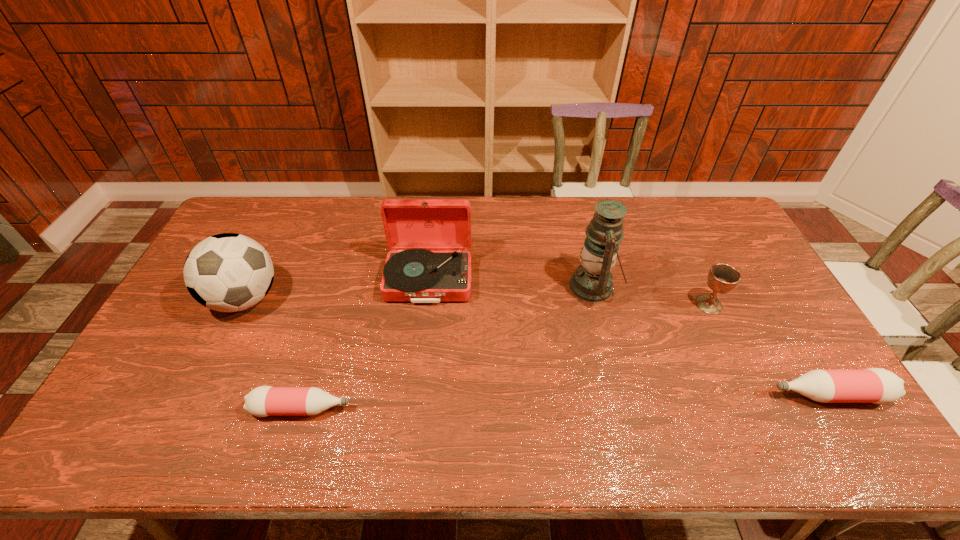
Where is `vacant space located 0.090m with the cap open on the shorter bottle`? vacant space located 0.090m with the cap open on the shorter bottle is located at coordinates (388, 409).

Locate an element on the screen. Image resolution: width=960 pixels, height=540 pixels. vacant area situated 0.280m with the cap open on the rightmost object is located at coordinates (660, 395).

Find the location of `free location located 0.160m with the cap open on the rightmost object`. free location located 0.160m with the cap open on the rightmost object is located at coordinates (708, 395).

Where is `vacant point located with the cap open on the rightmost object`? vacant point located with the cap open on the rightmost object is located at coordinates (653, 395).

Where is `free spot located 0.280m on the back of the chalice`? The width and height of the screenshot is (960, 540). free spot located 0.280m on the back of the chalice is located at coordinates (676, 235).

Locate an element on the screen. The image size is (960, 540). vacant area situated 0.090m on the back of the tallest object is located at coordinates (584, 245).

Find the location of a particular element. vacant region located on the front-facing side of the phonograph_record is located at coordinates pyautogui.click(x=416, y=400).

Identify the location of vacant space situated on the main logo of the soccer ball. pyautogui.click(x=218, y=354).

You are a GUI agent. You are given a task and a screenshot of the screen. Output one action in this format:
    pyautogui.click(x=<x>, y=<y>)
    Task: Click on the object that is at the left edge
    
    Given the screenshot: What is the action you would take?
    pyautogui.click(x=228, y=272)

Image resolution: width=960 pixels, height=540 pixels. What are the coordinates of `object at the right edge` in the screenshot? It's located at (873, 385).